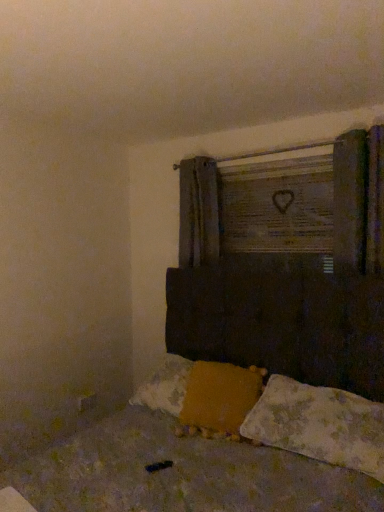
Question: Do you think fluffy white pillow at lower right, the 2th pillow viewed from the left, is within wooden sign at upper center, or outside of it?

Choices:
 (A) outside
 (B) inside

Answer: (A)

Question: In the image, is fluffy white pillow at lower right, the 1th pillow from the right, positioned in front of or behind wooden sign at upper center?

Choices:
 (A) front
 (B) behind

Answer: (A)

Question: Which of these objects is positioned closest to the yellow fabric pillow at lower center, marked as the second pillow in a right-to-left arrangement?

Choices:
 (A) wooden sign at upper center
 (B) fluffy white pillow at lower right, the 1th pillow from the right
 (C) dark brown wooden bed at center

Answer: (C)

Question: Based on their relative distances, which object is nearer to the wooden sign at upper center?

Choices:
 (A) yellow fabric pillow at lower center, marked as the second pillow in a right-to-left arrangement
 (B) fluffy white pillow at lower right, the 1th pillow from the right
 (C) dark brown wooden bed at center

Answer: (A)